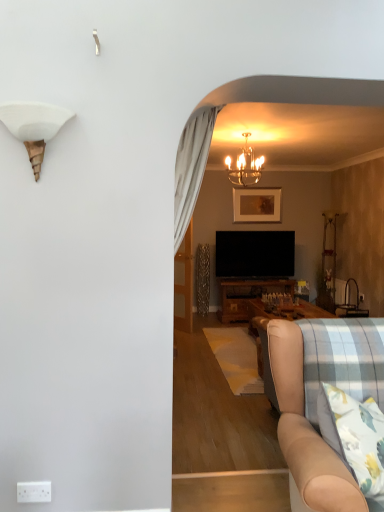
Question: Choose the correct answer: Is translucent glass chandelier at upper center, the second lamp from the front, inside white plastic power outlet at lower left or outside it?

Choices:
 (A) inside
 (B) outside

Answer: (B)

Question: Is translucent glass chandelier at upper center, the second lamp from the front, wider or thinner than white plastic power outlet at lower left?

Choices:
 (A) wide
 (B) thin

Answer: (A)

Question: Based on their relative distances, which object is farther from the transparent glass door at center?

Choices:
 (A) beige fabric couch at lower right
 (B) translucent glass chandelier at upper center, which ranks as the 2th lamp in bottom-to-top order
 (C) white matte shell at upper left, the 1th lamp from the front
 (D) wooden framed artwork at center
 (E) white plastic power outlet at lower left

Answer: (C)

Question: Which is nearer to the transparent glass door at center?

Choices:
 (A) translucent glass chandelier at upper center, which ranks as the 2th lamp in bottom-to-top order
 (B) wooden framed artwork at center
 (C) beige fabric couch at lower right
 (D) white matte shell at upper left, the 2th lamp in the top-to-bottom sequence
 (E) white plastic power outlet at lower left

Answer: (B)